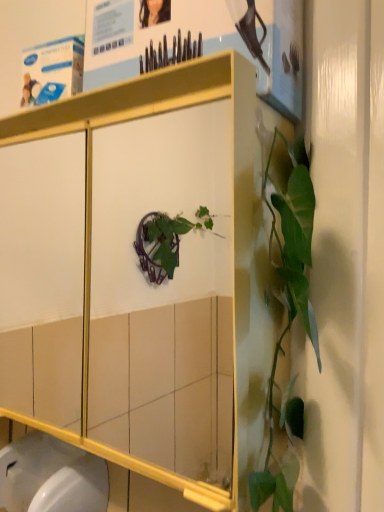
Question: From the image's perspective, is metallic white cabinet at center over matte paper poster at upper center?

Choices:
 (A) yes
 (B) no

Answer: (B)

Question: Is metallic white cabinet at center positioned behind matte paper poster at upper center?

Choices:
 (A) yes
 (B) no

Answer: (B)

Question: From a real-world perspective, does metallic white cabinet at center sit lower than matte paper poster at upper center?

Choices:
 (A) no
 (B) yes

Answer: (B)

Question: Is metallic white cabinet at center shorter than matte paper poster at upper center?

Choices:
 (A) no
 (B) yes

Answer: (A)

Question: Is metallic white cabinet at center to the right of matte paper poster at upper center from the viewer's perspective?

Choices:
 (A) no
 (B) yes

Answer: (A)

Question: Does metallic white cabinet at center have a greater height compared to matte paper poster at upper center?

Choices:
 (A) no
 (B) yes

Answer: (B)

Question: Does matte paper poster at upper center appear on the left side of white glossy toilet bowl at lower left?

Choices:
 (A) no
 (B) yes

Answer: (A)

Question: From the image's perspective, is matte paper poster at upper center on top of white glossy toilet bowl at lower left?

Choices:
 (A) yes
 (B) no

Answer: (A)

Question: Can you confirm if matte paper poster at upper center is bigger than white glossy toilet bowl at lower left?

Choices:
 (A) no
 (B) yes

Answer: (B)

Question: Are matte paper poster at upper center and white glossy toilet bowl at lower left located far from each other?

Choices:
 (A) no
 (B) yes

Answer: (A)

Question: Is matte paper poster at upper center touching white glossy toilet bowl at lower left?

Choices:
 (A) no
 (B) yes

Answer: (A)

Question: From a real-world perspective, is matte paper poster at upper center under white glossy toilet bowl at lower left?

Choices:
 (A) yes
 (B) no

Answer: (B)

Question: Does white glossy toilet bowl at lower left have a greater height compared to metallic white cabinet at center?

Choices:
 (A) no
 (B) yes

Answer: (A)